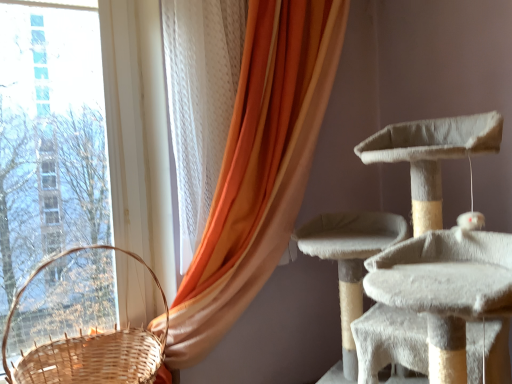
Question: Does orange fabric curtain at left turn towards woven wood basket at left?

Choices:
 (A) no
 (B) yes

Answer: (A)

Question: Is orange fabric curtain at left closer to camera compared to woven wood basket at left?

Choices:
 (A) yes
 (B) no

Answer: (B)

Question: Does orange fabric curtain at left have a smaller size compared to woven wood basket at left?

Choices:
 (A) yes
 (B) no

Answer: (B)

Question: Considering the relative sizes of orange fabric curtain at left and woven wood basket at left in the image provided, is orange fabric curtain at left wider than woven wood basket at left?

Choices:
 (A) no
 (B) yes

Answer: (A)

Question: Is orange fabric curtain at left to the left of woven wood basket at left from the viewer's perspective?

Choices:
 (A) yes
 (B) no

Answer: (B)

Question: Is orange fabric curtain at left beside woven wood basket at left?

Choices:
 (A) yes
 (B) no

Answer: (B)

Question: Does woven wood basket at left appear on the left side of orange fabric curtain at left?

Choices:
 (A) yes
 (B) no

Answer: (A)

Question: Is woven wood basket at left positioned beyond the bounds of orange fabric curtain at left?

Choices:
 (A) yes
 (B) no

Answer: (A)

Question: Can you confirm if woven wood basket at left is thinner than orange fabric curtain at left?

Choices:
 (A) no
 (B) yes

Answer: (A)

Question: Is woven wood basket at left facing towards orange fabric curtain at left?

Choices:
 (A) yes
 (B) no

Answer: (B)

Question: From a real-world perspective, is woven wood basket at left positioned over orange fabric curtain at left based on gravity?

Choices:
 (A) no
 (B) yes

Answer: (A)

Question: From a real-world perspective, is woven wood basket at left located beneath orange fabric curtain at left?

Choices:
 (A) no
 (B) yes

Answer: (B)

Question: Looking at the image, does woven wood basket at left seem bigger or smaller compared to orange fabric curtain at left?

Choices:
 (A) small
 (B) big

Answer: (A)